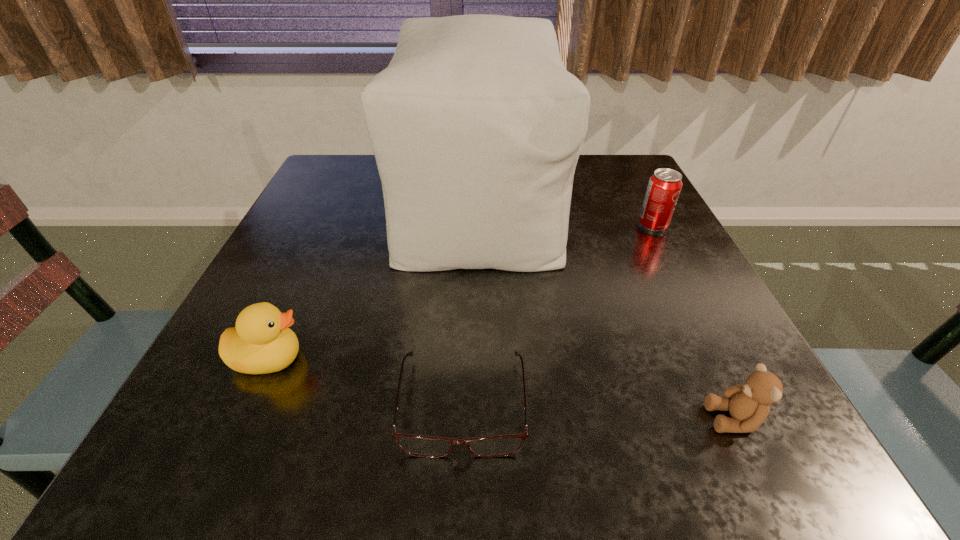
The image size is (960, 540). I want to click on vacant space that's between the duckling and the spectacles, so [x=366, y=381].

Identify the location of object that can be found as the second closest to the soda. The image size is (960, 540). (748, 404).

At what (x,y) coordinates should I click in order to perform the action: click on object that is the third closest to the duckling. Please return your answer as a coordinate pair (x, y). Image resolution: width=960 pixels, height=540 pixels. Looking at the image, I should click on click(x=748, y=404).

This screenshot has height=540, width=960. Find the location of `vacant space that satisfies the following two spatial constraints: 1. on the side of the soda with the smiley face; 2. on the left side of the tallest object`. vacant space that satisfies the following two spatial constraints: 1. on the side of the soda with the smiley face; 2. on the left side of the tallest object is located at coordinates (478, 225).

At what (x,y) coordinates should I click in order to perform the action: click on free space that satisfies the following two spatial constraints: 1. on the side of the cushion with the smiley face; 2. on the lenses of the spectacles. Please return your answer as a coordinate pair (x, y). Looking at the image, I should click on (477, 403).

The width and height of the screenshot is (960, 540). What are the coordinates of `vacant space that satisfies the following two spatial constraints: 1. on the side of the tallest object with the smiley face; 2. on the lenses of the spectacles` in the screenshot? It's located at (477, 403).